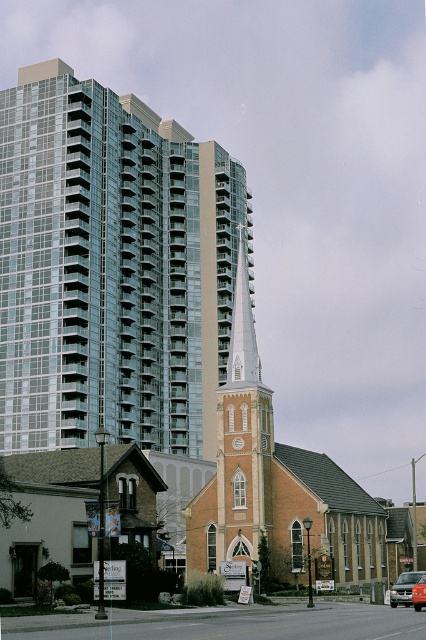
Question: Among these points, which one is farthest from the camera?

Choices:
 (A) (264, 531)
 (B) (425, 588)

Answer: (A)

Question: Which object appears farthest from the camera in this image?

Choices:
 (A) metallic silver van at center
 (B) glassy steel building at upper left

Answer: (B)

Question: Is glassy steel building at upper left thinner than metallic silver van at center?

Choices:
 (A) no
 (B) yes

Answer: (A)

Question: Can you confirm if glassy steel building at upper left is thinner than smooth white spire at center?

Choices:
 (A) no
 (B) yes

Answer: (A)

Question: Among these objects, which one is nearest to the camera?

Choices:
 (A) orange matte car at center
 (B) metallic silver van at center
 (C) brick church at center

Answer: (A)

Question: Can you confirm if brick church at center is positioned to the right of smooth white spire at center?

Choices:
 (A) yes
 (B) no

Answer: (A)